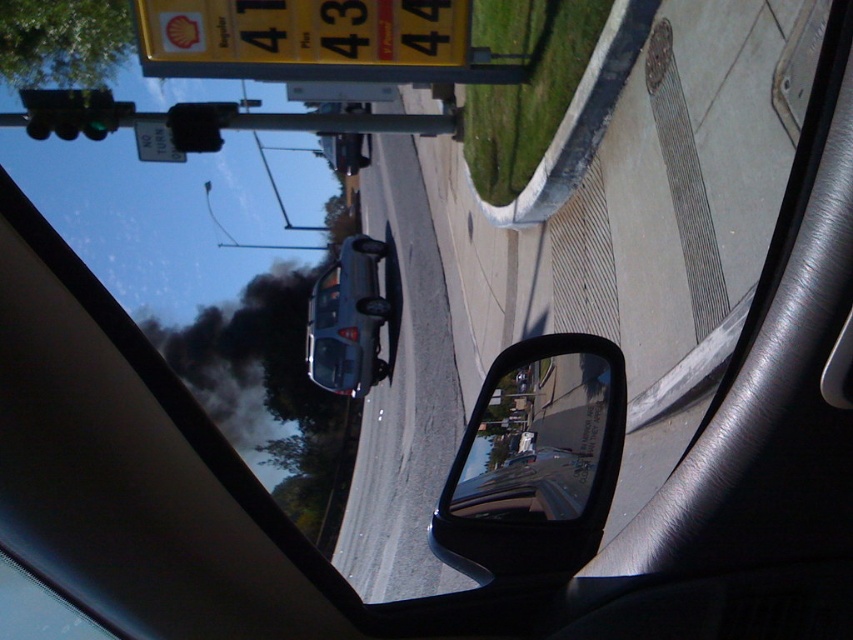
Question: Which object appears farthest from the camera in this image?

Choices:
 (A) satin silver sedan at center
 (B) green glass traffic light at upper left

Answer: (A)

Question: Based on their relative distances, which object is farther from the black glossy side mirror at lower right?

Choices:
 (A) green glass traffic light at upper left
 (B) satin silver sedan at center
 (C) black plastic traffic light at upper left

Answer: (B)

Question: Is black glossy side mirror at lower right thinner than satin silver sedan at center?

Choices:
 (A) yes
 (B) no

Answer: (A)

Question: Observing the image, what is the correct spatial positioning of green glass traffic light at upper left in reference to black plastic traffic light at upper left?

Choices:
 (A) left
 (B) right

Answer: (A)

Question: Is black glossy side mirror at lower right thinner than black plastic traffic light at upper left?

Choices:
 (A) no
 (B) yes

Answer: (B)

Question: Which point is closer to the camera taking this photo?

Choices:
 (A) [x=201, y=308]
 (B) [x=618, y=374]
 (C) [x=215, y=106]
 (D) [x=70, y=140]

Answer: (B)